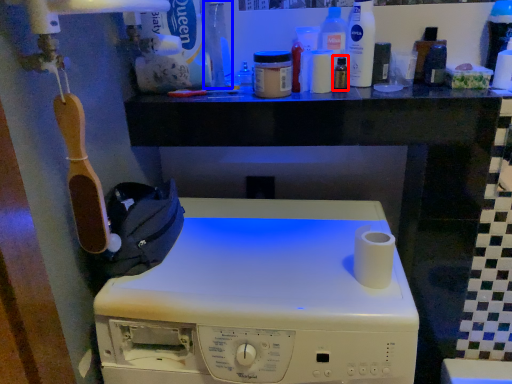
Question: Which object appears closest to the camera in this image, toiletry (highlighted by a red box) or bottle (highlighted by a blue box)?

Choices:
 (A) toiletry
 (B) bottle

Answer: (B)